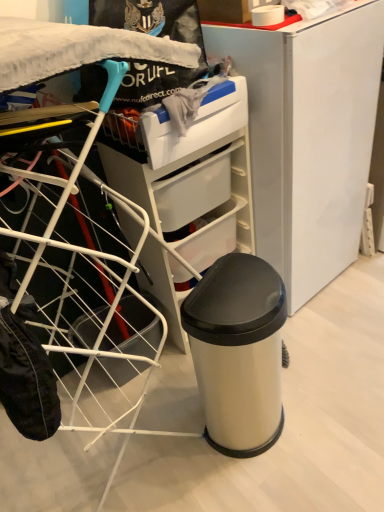
Locate an element on the screen. This screenshot has width=384, height=512. satin silver trash can at center is located at coordinates (238, 352).

What is the approximate height of satin white fridge at center?

It is 3.94 feet.

The height and width of the screenshot is (512, 384). Identify the location of satin white laundry basket at left. (77, 259).

Between satin white fridge at center and satin silver trash can at center, which one has larger width?

satin white fridge at center is wider.

Can you confirm if satin white fridge at center is bigger than satin silver trash can at center?

Indeed, satin white fridge at center has a larger size compared to satin silver trash can at center.

Find the location of a particular element. The height and width of the screenshot is (512, 384). furniture on the right of satin silver trash can at center is located at coordinates (309, 137).

Would you say satin white fridge at center is a long distance from satin white laundry basket at left?

They are positioned close to each other.

How far apart are satin white fridge at center and satin white laundry basket at left?

A distance of 70.58 centimeters exists between satin white fridge at center and satin white laundry basket at left.

Which of these two, satin white fridge at center or satin white laundry basket at left, is thinner?

satin white fridge at center is thinner.

Is satin white fridge at center in front of or behind satin white laundry basket at left in the image?

Clearly, satin white fridge at center is behind satin white laundry basket at left.

Is satin silver trash can at center not close to satin white laundry basket at left?

satin silver trash can at center is near satin white laundry basket at left, not far away.

Is satin silver trash can at center closer to camera compared to satin white laundry basket at left?

No, it is not.

Locate an element on the screen. waste container that is below the satin white laundry basket at left (from the image's perspective) is located at coordinates (238, 352).

Is satin white laundry basket at left to the left or to the right of satin white fridge at center in the image?

In the image, satin white laundry basket at left appears on the left side of satin white fridge at center.

Considering the sizes of satin white laundry basket at left and satin white fridge at center in the image, is satin white laundry basket at left taller or shorter than satin white fridge at center?

Considering their sizes, satin white laundry basket at left has more height than satin white fridge at center.

Does satin white laundry basket at left have a smaller size compared to satin white fridge at center?

No, satin white laundry basket at left is not smaller than satin white fridge at center.

Who is more distant, satin white laundry basket at left or satin white fridge at center?

satin white fridge at center is further away from the camera.

Considering the positions of point (224, 446) and point (369, 1), is point (224, 446) closer or farther from the camera than point (369, 1)?

Point (224, 446).

Is satin silver trash can at center oriented towards satin white fridge at center?

No.

Is satin silver trash can at center inside the boundaries of satin white fridge at center, or outside?

satin silver trash can at center is not enclosed by satin white fridge at center.

In the image, is satin silver trash can at center on the left side or the right side of satin white fridge at center?

satin silver trash can at center is positioned on satin white fridge at center's left side.

In order to click on wide that appears above the satin silver trash can at center (from the image's perspective) in this screenshot , I will do `click(77, 259)`.

Is point (105, 372) closer or farther from the camera than point (223, 286)?

Point (105, 372) is farther from the camera than point (223, 286).

Looking at this image, considering the positions of objects satin white laundry basket at left and satin silver trash can at center in the image provided, who is behind, satin white laundry basket at left or satin silver trash can at center?

satin silver trash can at center.

Can satin silver trash can at center be found inside satin white laundry basket at left?

No, satin white laundry basket at left does not contain satin silver trash can at center.

Where is `waste container in front of the satin white fridge at center`? The height and width of the screenshot is (512, 384). waste container in front of the satin white fridge at center is located at coordinates (238, 352).

Locate an element on the screen. furniture that is on the right side of satin white laundry basket at left is located at coordinates click(x=309, y=137).

Considering their positions, is satin white laundry basket at left positioned closer to satin white fridge at center than satin silver trash can at center?

The object closer to satin white fridge at center is satin silver trash can at center.

Estimate the real-world distances between objects in this image. Which object is closer to satin white laundry basket at left, satin silver trash can at center or satin white fridge at center?

satin silver trash can at center lies closer to satin white laundry basket at left than the other object.

When comparing their distances from satin white fridge at center, does satin silver trash can at center or satin white laundry basket at left seem closer?

Based on the image, satin silver trash can at center appears to be nearer to satin white fridge at center.

Considering their positions, is satin white laundry basket at left positioned closer to satin silver trash can at center than satin white fridge at center?

The object closer to satin silver trash can at center is satin white laundry basket at left.

Based on their spatial positions, is satin white fridge at center or satin silver trash can at center closer to satin white laundry basket at left?

Based on the image, satin silver trash can at center appears to be nearer to satin white laundry basket at left.

Which object lies nearer to the anchor point satin silver trash can at center, satin white fridge at center or satin white laundry basket at left?

The object closer to satin silver trash can at center is satin white laundry basket at left.

Find the location of a particular element. waste container between satin white laundry basket at left and satin white fridge at center from left to right is located at coordinates (238, 352).